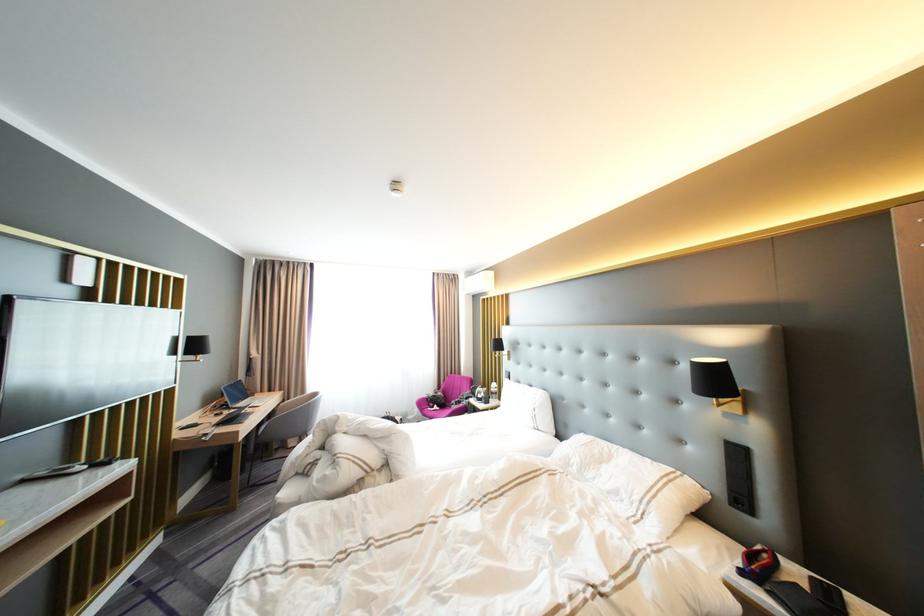
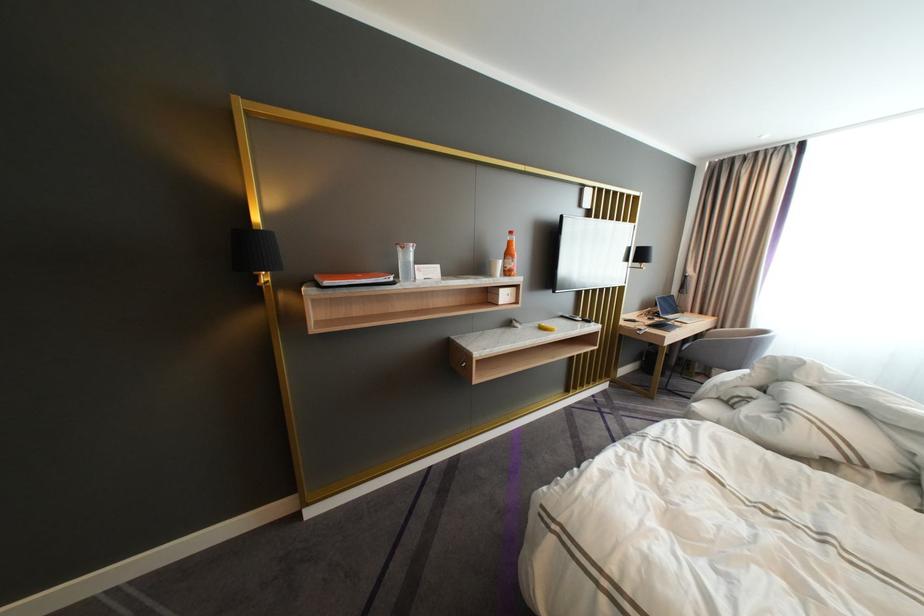
Locate, in the second image, the point that corresponds to pixel 54 474 in the first image.

(578, 315)